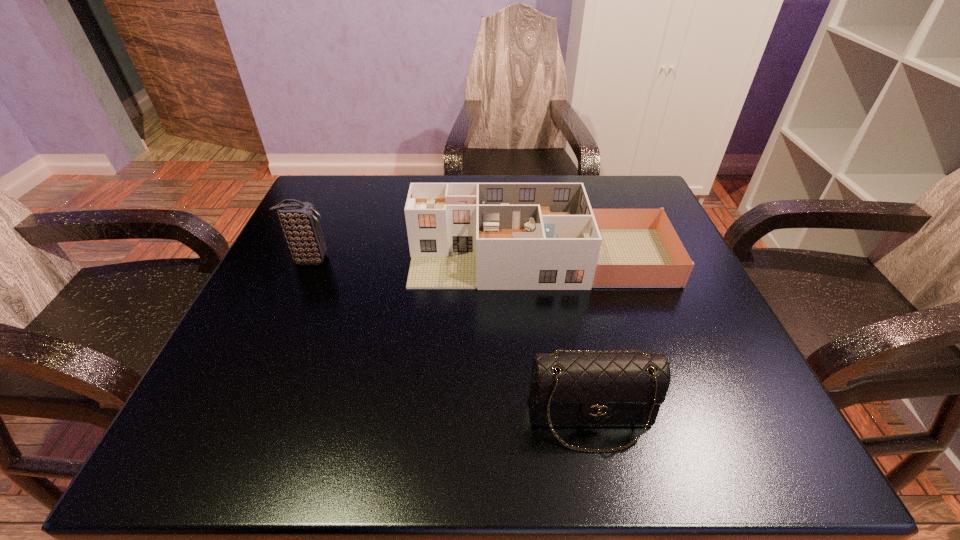
Identify the location of vacant space in between the nearest object and the leftmost object. This screenshot has height=540, width=960. (450, 339).

You are a GUI agent. You are given a task and a screenshot of the screen. Output one action in this format:
    pyautogui.click(x=<x>, y=<y>)
    Task: Click on the free space between the leftmost object and the nearest object
    The image size is (960, 540).
    Given the screenshot: What is the action you would take?
    pyautogui.click(x=450, y=339)

Image resolution: width=960 pixels, height=540 pixels. What are the coordinates of `free space between the right clutch bag and the farther clutch bag` in the screenshot? It's located at (450, 339).

Locate an element on the screen. This screenshot has width=960, height=540. free spot between the dollhouse and the right clutch bag is located at coordinates (565, 338).

The height and width of the screenshot is (540, 960). I want to click on unoccupied position between the dollhouse and the shorter clutch bag, so click(565, 338).

Find the location of a particular element. object that is the second closest to the right clutch bag is located at coordinates (299, 220).

Find the location of a particular element. The height and width of the screenshot is (540, 960). object that is the second closest one to the farther clutch bag is located at coordinates (589, 389).